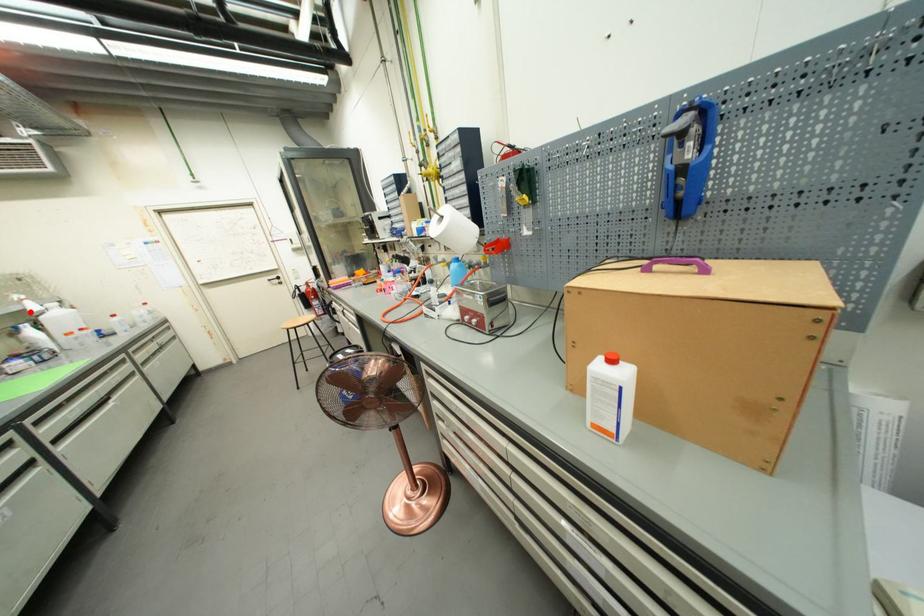
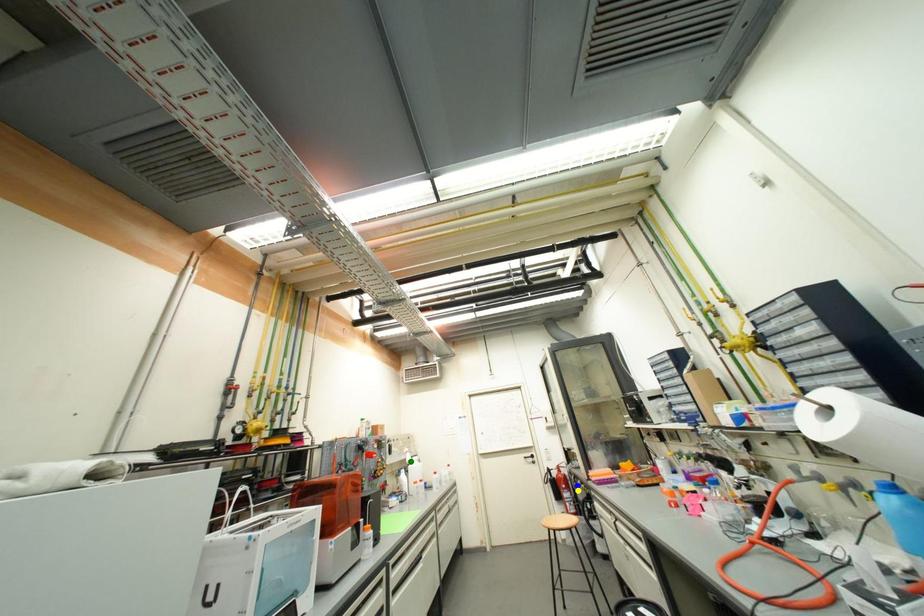
Question: I am providing you with two images of the same scene from different viewpoints. A red point is marked on the first image. You are given multiple points on the second image. Which spot in image 2 lines up with the point in image 1?

Choices:
 (A) blue point
 (B) green point
 (C) yellow point

Answer: (B)